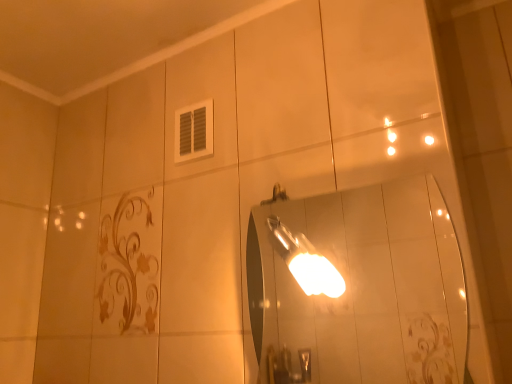
Question: In terms of size, does glossy silver mirror at center appear bigger or smaller than metallic silver light fixture at center?

Choices:
 (A) big
 (B) small

Answer: (A)

Question: Is glossy silver mirror at center inside or outside of metallic silver light fixture at center?

Choices:
 (A) inside
 (B) outside

Answer: (B)

Question: Is point (460, 304) closer or farther from the camera than point (283, 240)?

Choices:
 (A) closer
 (B) farther

Answer: (B)

Question: From a real-world perspective, relative to glossy silver mirror at center, is metallic silver light fixture at center vertically above or below?

Choices:
 (A) below
 (B) above

Answer: (B)

Question: Is metallic silver light fixture at center spatially inside glossy silver mirror at center, or outside of it?

Choices:
 (A) inside
 (B) outside

Answer: (B)

Question: Based on their positions, is metallic silver light fixture at center located to the left or right of glossy silver mirror at center?

Choices:
 (A) left
 (B) right

Answer: (A)

Question: Is metallic silver light fixture at center taller or shorter than glossy silver mirror at center?

Choices:
 (A) short
 (B) tall

Answer: (A)